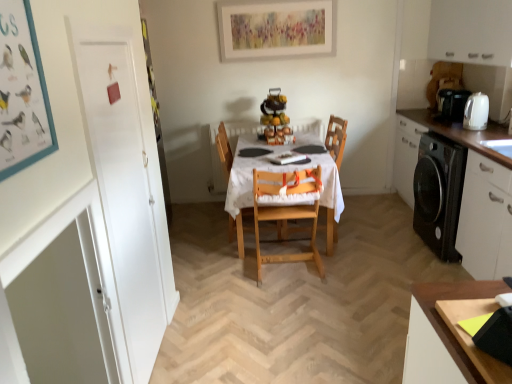
Identify the location of spots to the right of natural wood highchair at center, the 1th chair when ordered from front to back. (355, 263).